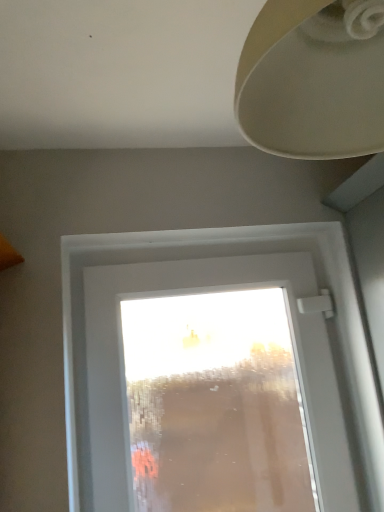
The width and height of the screenshot is (384, 512). In order to click on transparent glass window at center in this screenshot , I will do `click(206, 290)`.

The image size is (384, 512). What do you see at coordinates (206, 290) in the screenshot?
I see `transparent glass window at center` at bounding box center [206, 290].

Measure the distance between point (338,114) and camera.

A distance of 20.67 inches exists between point (338,114) and camera.

Where is `matte beige lampshade at upper right`? The image size is (384, 512). matte beige lampshade at upper right is located at coordinates (314, 79).

What do you see at coordinates (314, 79) in the screenshot? This screenshot has width=384, height=512. I see `matte beige lampshade at upper right` at bounding box center [314, 79].

The image size is (384, 512). Find the location of `transparent glass window at center`. transparent glass window at center is located at coordinates (206, 290).

Would you say transparent glass window at center is to the left or to the right of matte beige lampshade at upper right in the picture?

Based on their positions, transparent glass window at center is located to the left of matte beige lampshade at upper right.

Is the depth of transparent glass window at center greater than that of matte beige lampshade at upper right?

That is True.

Between point (123, 389) and point (280, 17), which one is positioned in front?

The point (280, 17) is in front.

From the image's perspective, which one is positioned lower, transparent glass window at center or matte beige lampshade at upper right?

transparent glass window at center appears lower in the image.

From a real-world perspective, which is physically above, transparent glass window at center or matte beige lampshade at upper right?

In real-world perspective, matte beige lampshade at upper right is above.

Looking at their sizes, would you say transparent glass window at center is wider or thinner than matte beige lampshade at upper right?

Considering their sizes, transparent glass window at center looks slimmer than matte beige lampshade at upper right.

Considering the sizes of objects transparent glass window at center and matte beige lampshade at upper right in the image provided, who is taller, transparent glass window at center or matte beige lampshade at upper right?

Standing taller between the two is transparent glass window at center.

Looking at the image, does transparent glass window at center seem bigger or smaller compared to matte beige lampshade at upper right?

transparent glass window at center is bigger than matte beige lampshade at upper right.

Choose the correct answer: Is transparent glass window at center inside matte beige lampshade at upper right or outside it?

transparent glass window at center is outside matte beige lampshade at upper right.

Is transparent glass window at center positioned far away from matte beige lampshade at upper right?

That's not correct — transparent glass window at center is a little close to matte beige lampshade at upper right.

Is matte beige lampshade at upper right at the back of transparent glass window at center?

No, transparent glass window at center is not facing away from matte beige lampshade at upper right.

Where is `window on the left side of matte beige lampshade at upper right`? This screenshot has height=512, width=384. window on the left side of matte beige lampshade at upper right is located at coordinates (206, 290).

Between matte beige lampshade at upper right and transparent glass window at center, which one appears on the right side from the viewer's perspective?

From the viewer's perspective, matte beige lampshade at upper right appears more on the right side.

Which object is more forward, matte beige lampshade at upper right or transparent glass window at center?

Positioned in front is matte beige lampshade at upper right.

In the scene shown: Which is farther, (257,75) or (323,502)?

The point (323,502) is more distant.

From the image's perspective, does matte beige lampshade at upper right appear lower than transparent glass window at center?

No, from the image's perspective, matte beige lampshade at upper right is not beneath transparent glass window at center.

From a real-world perspective, is matte beige lampshade at upper right positioned over transparent glass window at center based on gravity?

Yes.

Considering the sizes of matte beige lampshade at upper right and transparent glass window at center in the image, is matte beige lampshade at upper right wider or thinner than transparent glass window at center?

Clearly, matte beige lampshade at upper right has more width compared to transparent glass window at center.

Considering the sizes of objects matte beige lampshade at upper right and transparent glass window at center in the image provided, who is shorter, matte beige lampshade at upper right or transparent glass window at center?

matte beige lampshade at upper right.

Based on their sizes in the image, would you say matte beige lampshade at upper right is bigger or smaller than transparent glass window at center?

Considering their sizes, matte beige lampshade at upper right takes up less space than transparent glass window at center.

Which is correct: matte beige lampshade at upper right is inside transparent glass window at center, or outside of it?

matte beige lampshade at upper right lies outside transparent glass window at center.

Is matte beige lampshade at upper right with transparent glass window at center?

No, matte beige lampshade at upper right is not in contact with transparent glass window at center.

Is transparent glass window at center at the back of matte beige lampshade at upper right?

No, matte beige lampshade at upper right is not facing away from transparent glass window at center.

How different are the orientations of matte beige lampshade at upper right and transparent glass window at center in degrees?

matte beige lampshade at upper right and transparent glass window at center are facing 92.6 degrees away from each other.

Where is `lamp lying on the right of transparent glass window at center`? lamp lying on the right of transparent glass window at center is located at coordinates (314, 79).

Image resolution: width=384 pixels, height=512 pixels. Find the location of `window located underneath the matte beige lampshade at upper right (from a real-world perspective)`. window located underneath the matte beige lampshade at upper right (from a real-world perspective) is located at coordinates (206, 290).

The height and width of the screenshot is (512, 384). In order to click on lamp lying on the right of transparent glass window at center in this screenshot , I will do `click(314, 79)`.